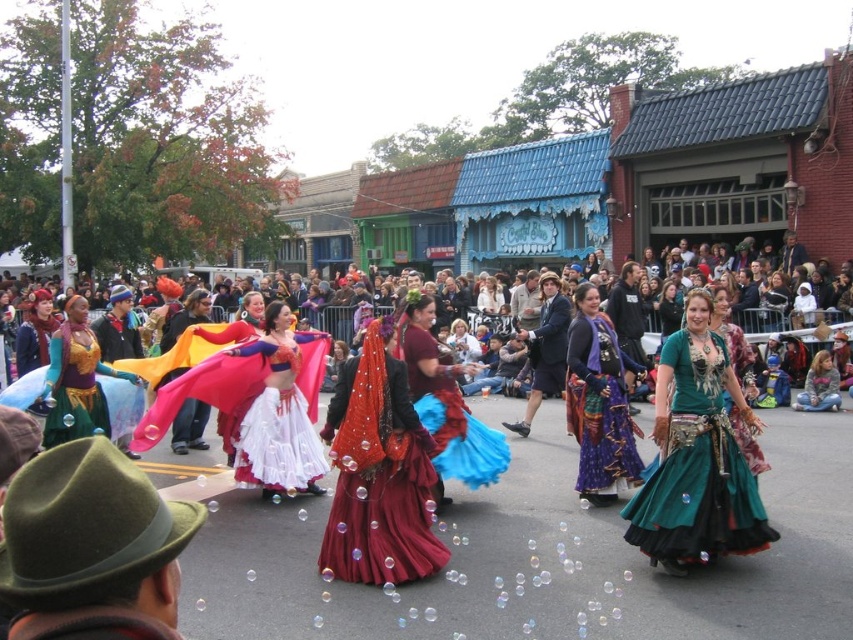
Question: Which of the following is the farthest from the observer?

Choices:
 (A) shiny red fabric at center
 (B) purple satin dress at center
 (C) matte red dress at center

Answer: (A)

Question: Is maroon satin skirt at center further to camera compared to shiny red fabric at center?

Choices:
 (A) no
 (B) yes

Answer: (A)

Question: Which object appears farthest from the camera in this image?

Choices:
 (A) maroon satin skirt at center
 (B) green metallic skirt at center
 (C) flannel shirt at lower right
 (D) matte red dress at center

Answer: (C)

Question: Estimate the real-world distances between objects in this image. Which object is closer to the purple satin dress at center?

Choices:
 (A) matte gold dress at left
 (B) green metallic skirt at center
 (C) shiny red fabric at center
 (D) matte red dress at center

Answer: (B)

Question: Does green metallic skirt at center appear over matte red dress at center?

Choices:
 (A) no
 (B) yes

Answer: (A)

Question: Can you confirm if velvet maroon dress at center is positioned above flannel shirt at lower right?

Choices:
 (A) yes
 (B) no

Answer: (B)